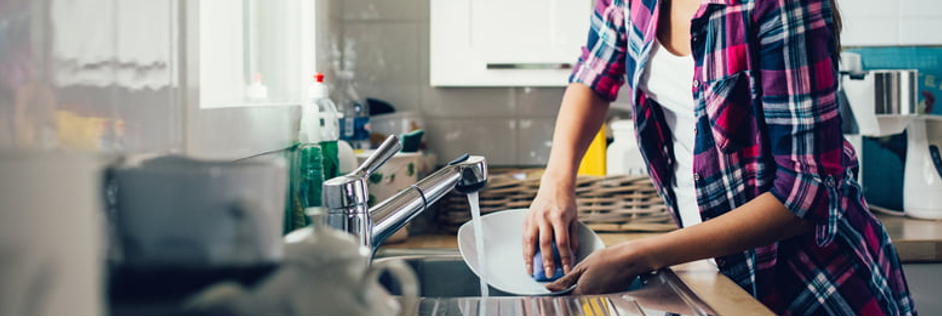
In order to click on kitchen window in this screenshot , I will do `click(223, 56)`.